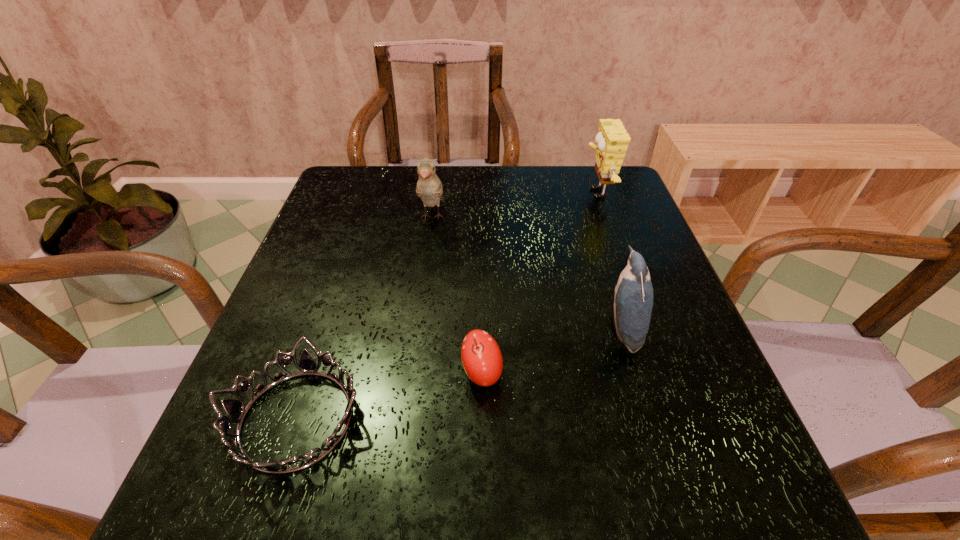
This screenshot has height=540, width=960. Identify the location of object situated at the left edge. (235, 409).

Identify the location of sponge at the right edge. The image size is (960, 540). (612, 140).

The width and height of the screenshot is (960, 540). What are the coordinates of `bird that is at the right edge` in the screenshot? It's located at (633, 302).

Locate an element on the screen. The height and width of the screenshot is (540, 960). object that is at the near left corner is located at coordinates (235, 409).

Where is `object that is at the far right corner`? object that is at the far right corner is located at coordinates (612, 140).

Image resolution: width=960 pixels, height=540 pixels. What are the coordinates of `vacant area at the far edge of the desktop` in the screenshot? It's located at (528, 188).

Locate an element on the screen. This screenshot has height=540, width=960. free spot at the near edge of the desktop is located at coordinates (516, 479).

The height and width of the screenshot is (540, 960). I want to click on free space at the left edge of the desktop, so click(x=324, y=323).

This screenshot has width=960, height=540. In the image, there is a desktop. Identify the location of vacant space at the right edge. (660, 376).

Where is `vacant space at the far left corner of the desktop`? This screenshot has height=540, width=960. vacant space at the far left corner of the desktop is located at coordinates (369, 205).